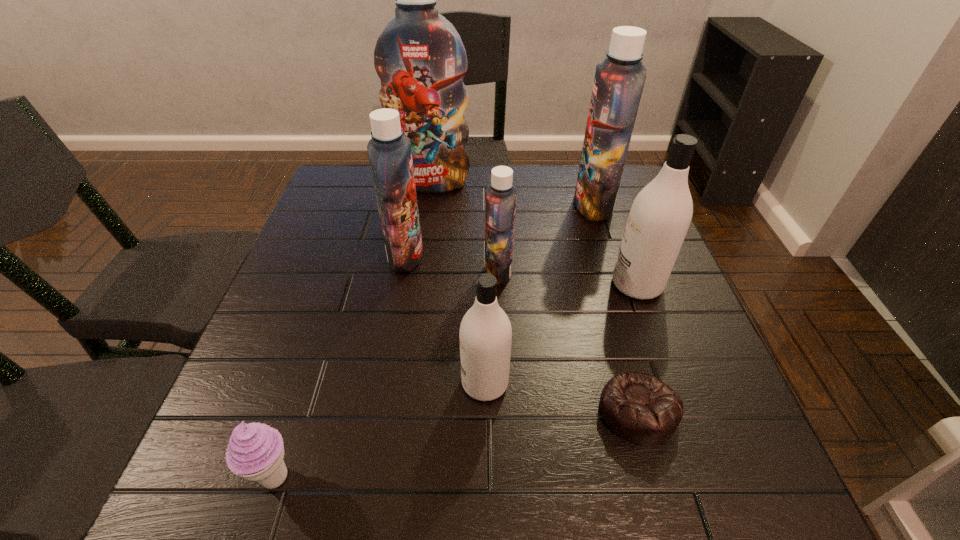
You are a GUI agent. You are given a task and a screenshot of the screen. Output one action in this format:
    pyautogui.click(x=<x>, y=<y>)
    Task: Click on the shampoo that stands as the third closest to the second shortest object
    The width and height of the screenshot is (960, 540).
    Given the screenshot: What is the action you would take?
    pyautogui.click(x=500, y=196)

I want to click on blue shampoo that stands as the closest to the rightmost blue shampoo, so click(500, 196).

Where is `the second closest blue shampoo to the second smallest blue shampoo`? Image resolution: width=960 pixels, height=540 pixels. the second closest blue shampoo to the second smallest blue shampoo is located at coordinates (420, 58).

You are a GUI agent. You are given a task and a screenshot of the screen. Output one action in this format:
    pyautogui.click(x=<x>, y=<y>)
    Task: Click on the vacant region that satisfies the following two spatial constraints: 1. on the front label of the second smallest blue shampoo; 2. on the left side of the shortest object
    The width and height of the screenshot is (960, 540).
    Given the screenshot: What is the action you would take?
    pyautogui.click(x=377, y=411)

The width and height of the screenshot is (960, 540). Find the location of `blank space that satisfies the following two spatial constraints: 1. on the front label of the smallest blue shampoo; 2. on the left side of the brown beanbag`. blank space that satisfies the following two spatial constraints: 1. on the front label of the smallest blue shampoo; 2. on the left side of the brown beanbag is located at coordinates coord(504,411).

Locate an element on the screen. Image resolution: width=960 pixels, height=540 pixels. blank space that satisfies the following two spatial constraints: 1. on the front label of the shortest object; 2. on the left side of the third biggest blue shampoo is located at coordinates (377, 411).

Identify the location of free space that satisfies the following two spatial constraints: 1. on the front-facing side of the shortest object; 2. on the left side of the nearest shampoo. Image resolution: width=960 pixels, height=540 pixels. (485, 411).